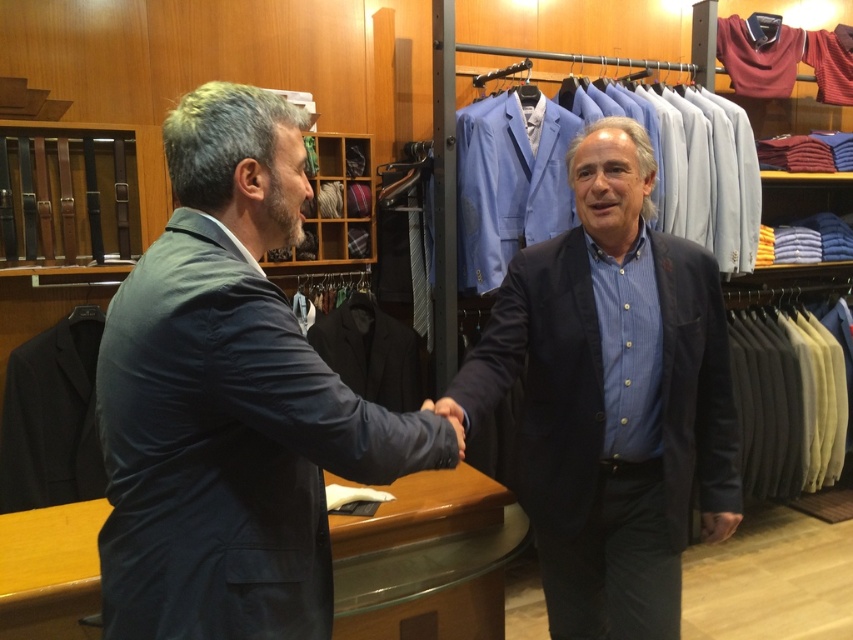
Question: Is dark blue suit at left above matte black blazer at center?

Choices:
 (A) yes
 (B) no

Answer: (A)

Question: Which point appears closest to the camera in this image?

Choices:
 (A) (195, 320)
 (B) (460, 413)
 (C) (576, 252)

Answer: (A)

Question: Which object is the closest to the dark blue suit at left?

Choices:
 (A) matte black blazer at center
 (B) matte black hand at center

Answer: (B)

Question: Is the position of dark blue suit at left less distant than that of matte black blazer at center?

Choices:
 (A) yes
 (B) no

Answer: (A)

Question: Which point is closer to the camera?

Choices:
 (A) matte black hand at center
 (B) dark blue suit at left
 (C) matte black blazer at center

Answer: (B)

Question: Does matte black blazer at center have a larger size compared to matte black hand at center?

Choices:
 (A) yes
 (B) no

Answer: (A)